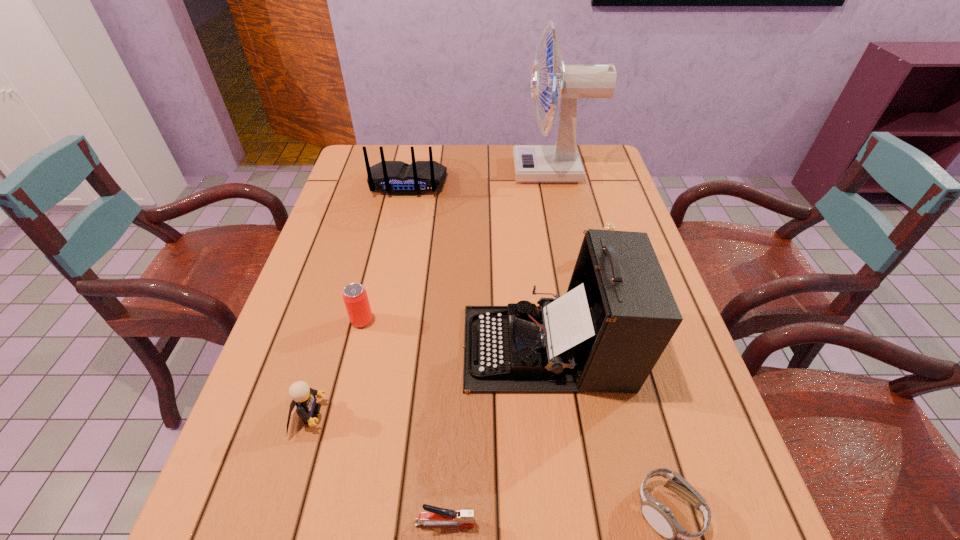
Locate an element on the screen. fan is located at coordinates (560, 163).

The image size is (960, 540). Find the location of `the second tallest object`. the second tallest object is located at coordinates (606, 334).

Where is `router`? This screenshot has width=960, height=540. router is located at coordinates (397, 178).

Identify the location of the sixth nearest object. (608, 226).

Identify the location of the farther Lego. (608, 226).

You are a GUI agent. You are given a task and a screenshot of the screen. Output one action in this format:
    pyautogui.click(x=<x>, y=<y>)
    Task: Click on the beer can
    This screenshot has width=960, height=540.
    Given the screenshot: What is the action you would take?
    pyautogui.click(x=355, y=297)

Find the location of a particular element. The height and width of the screenshot is (540, 960). the left Lego is located at coordinates (304, 397).

You are a GUI agent. You are given a task and a screenshot of the screen. Output one action in this format:
    pyautogui.click(x=<x>, y=<y>)
    Task: Click on the stapler
    The width and height of the screenshot is (960, 540).
    Given the screenshot: What is the action you would take?
    pyautogui.click(x=436, y=516)

Find the location of a particular element. This screenshot has height=540, width=960. vacant space positioned 0.240m on the front-facing side of the tallest object is located at coordinates (441, 171).

Where is `vacant area located 0.280m on the front-facing side of the tallest object`? vacant area located 0.280m on the front-facing side of the tallest object is located at coordinates (428, 171).